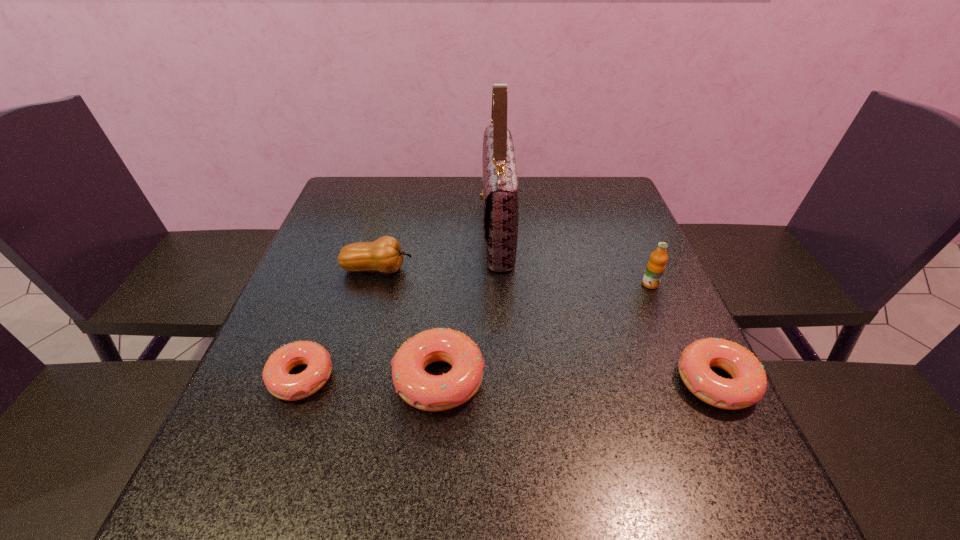
What are the coordinates of `orange juice that is positioned at the right edge` in the screenshot? It's located at (656, 265).

This screenshot has height=540, width=960. In order to click on object at the near right corner in this screenshot , I will do `click(749, 383)`.

You are a GUI agent. You are given a task and a screenshot of the screen. Output one action in this format:
    pyautogui.click(x=<x>, y=<y>)
    Task: Click on the vacant space at the far edge of the desktop
    
    Given the screenshot: What is the action you would take?
    pyautogui.click(x=425, y=181)

Find the location of `vacant region at the left edge of the desktop`. vacant region at the left edge of the desktop is located at coordinates (311, 245).

I want to click on blank space at the right edge of the desktop, so click(629, 292).

Where is `vacant area at the near left corner of the desktop`? vacant area at the near left corner of the desktop is located at coordinates (265, 426).

You are a GUI agent. You are given a task and a screenshot of the screen. Output one action in this format:
    pyautogui.click(x=<x>, y=<y>)
    Task: Click on the vacant space at the far right corner of the desktop
    This screenshot has width=960, height=540.
    Given the screenshot: What is the action you would take?
    pyautogui.click(x=596, y=176)

Identify the location of vacant space in between the gourd and the orange juice. The height and width of the screenshot is (540, 960). (514, 276).

You are a GUI agent. You are given a task and a screenshot of the screen. Output one action in this format:
    pyautogui.click(x=<x>, y=<y>)
    Task: Click on the free spot between the fifth shortest object and the handbag
    The height and width of the screenshot is (540, 960).
    Given the screenshot: What is the action you would take?
    pyautogui.click(x=574, y=257)

The width and height of the screenshot is (960, 540). Find the location of `unoccupied position between the leftmost doughnut and the fifth shortest object`. unoccupied position between the leftmost doughnut and the fifth shortest object is located at coordinates (476, 331).